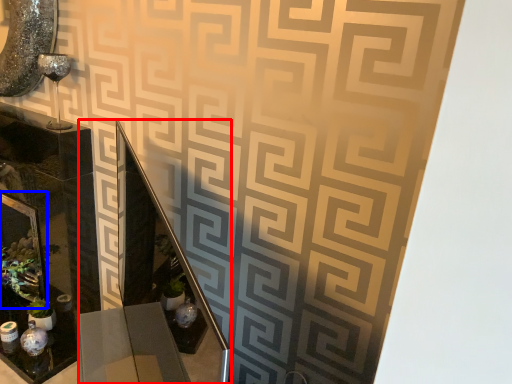
Question: Which of the following is the closest to the observer, vanity (highlighted by a red box) or picture frame (highlighted by a blue box)?

Choices:
 (A) vanity
 (B) picture frame

Answer: (A)